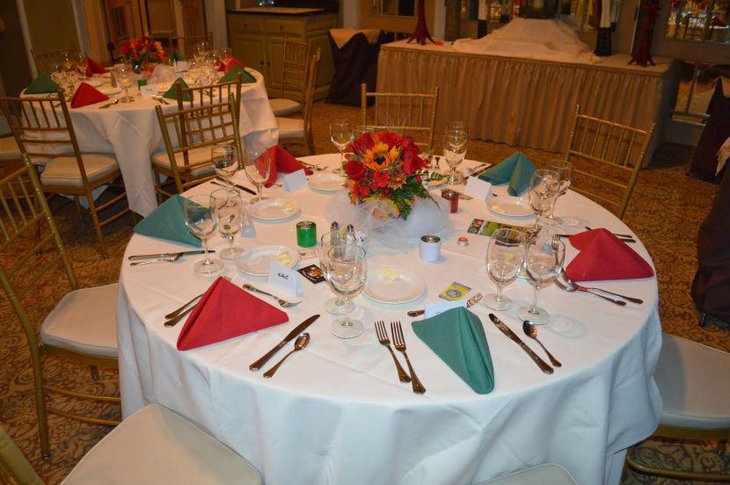
Where is `chair`? The image size is (730, 485). chair is located at coordinates coord(69,306).